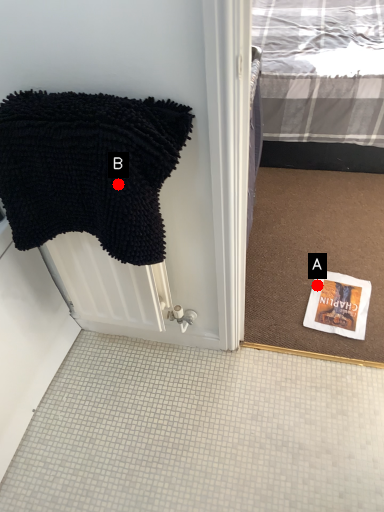
Question: Two points are circled on the image, labeled by A and B beside each circle. Which point is farther from the camera taking this photo?

Choices:
 (A) A is further
 (B) B is further

Answer: (A)